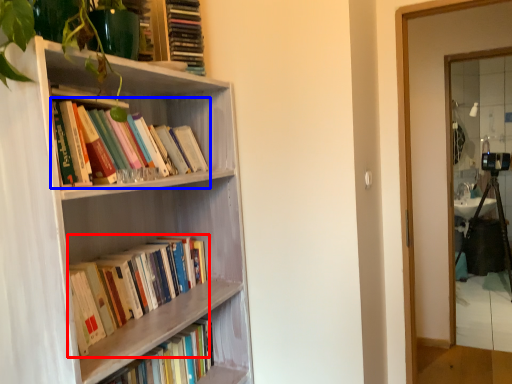
Question: Which object appears farthest to the camera in this image, book (highlighted by a red box) or book (highlighted by a blue box)?

Choices:
 (A) book
 (B) book

Answer: (A)